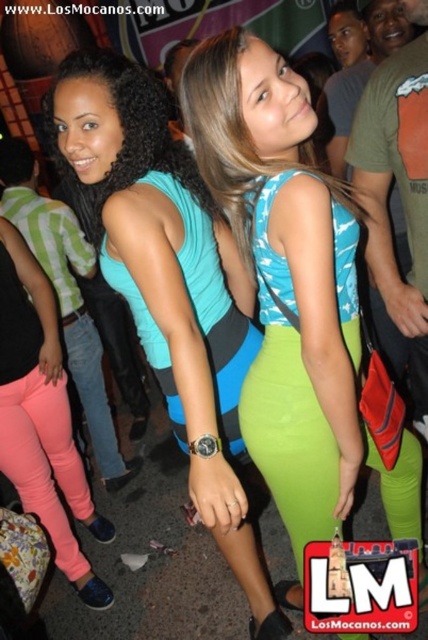
Question: Does teal fabric dress at center appear on the left side of pink matte leggings at lower left?

Choices:
 (A) no
 (B) yes

Answer: (A)

Question: Which of these objects is positioned farthest from the pink matte leggings at lower left?

Choices:
 (A) blue fabric dress at center
 (B) teal fabric dress at center

Answer: (A)

Question: Can you confirm if blue fabric dress at center is thinner than teal fabric dress at center?

Choices:
 (A) yes
 (B) no

Answer: (B)

Question: Is blue fabric dress at center to the right of pink matte leggings at lower left from the viewer's perspective?

Choices:
 (A) no
 (B) yes

Answer: (B)

Question: Which of the following is the closest to the observer?

Choices:
 (A) blue fabric dress at center
 (B) pink matte leggings at lower left
 (C) teal fabric dress at center

Answer: (A)

Question: Based on their relative distances, which object is nearer to the teal fabric dress at center?

Choices:
 (A) blue fabric dress at center
 (B) pink matte leggings at lower left

Answer: (A)